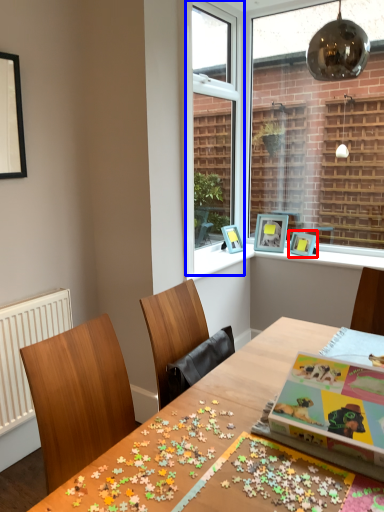
Question: Which object appears farthest to the camera in this image, picture frame (highlighted by a red box) or window frame (highlighted by a blue box)?

Choices:
 (A) picture frame
 (B) window frame

Answer: (A)